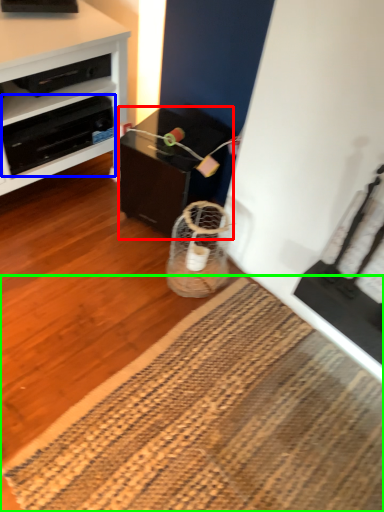
Question: Which object is the farthest from table (highlighted by a red box)? Choose among these: drawer (highlighted by a blue box) or mat (highlighted by a green box).

Choices:
 (A) drawer
 (B) mat

Answer: (B)